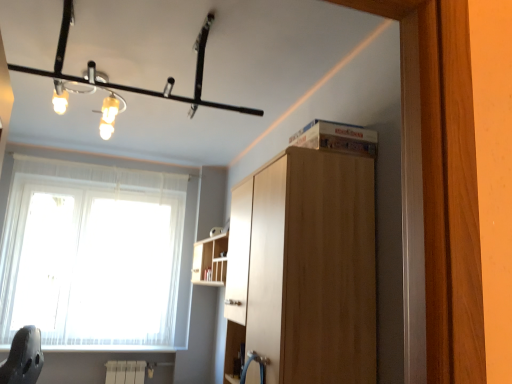
Question: Does wooden shelf at upper center have a lesser height compared to light brown wood cabinet at upper center?

Choices:
 (A) no
 (B) yes

Answer: (B)

Question: Is wooden shelf at upper center not close to light brown wood cabinet at upper center?

Choices:
 (A) yes
 (B) no

Answer: (A)

Question: Is wooden shelf at upper center facing away from light brown wood cabinet at upper center?

Choices:
 (A) yes
 (B) no

Answer: (B)

Question: Would you say light brown wood cabinet at upper center is part of wooden shelf at upper center's contents?

Choices:
 (A) no
 (B) yes

Answer: (A)

Question: Is wooden shelf at upper center to the right of light brown wood cabinet at upper center from the viewer's perspective?

Choices:
 (A) no
 (B) yes

Answer: (A)

Question: Is wooden shelf at upper center aimed at light brown wood cabinet at upper center?

Choices:
 (A) yes
 (B) no

Answer: (B)

Question: Would you say matte black light fixture at upper center is part of wooden shelf at upper center's contents?

Choices:
 (A) no
 (B) yes

Answer: (A)

Question: Is wooden shelf at upper center oriented towards matte black light fixture at upper center?

Choices:
 (A) no
 (B) yes

Answer: (A)

Question: From a real-world perspective, is wooden shelf at upper center over matte black light fixture at upper center?

Choices:
 (A) yes
 (B) no

Answer: (B)

Question: Is wooden shelf at upper center at the left side of matte black light fixture at upper center?

Choices:
 (A) yes
 (B) no

Answer: (B)

Question: Is wooden shelf at upper center oriented away from matte black light fixture at upper center?

Choices:
 (A) yes
 (B) no

Answer: (B)

Question: Does wooden shelf at upper center have a greater height compared to matte black light fixture at upper center?

Choices:
 (A) no
 (B) yes

Answer: (B)

Question: Would you say matte black light fixture at upper center contains wooden shelf at upper center?

Choices:
 (A) yes
 (B) no

Answer: (B)